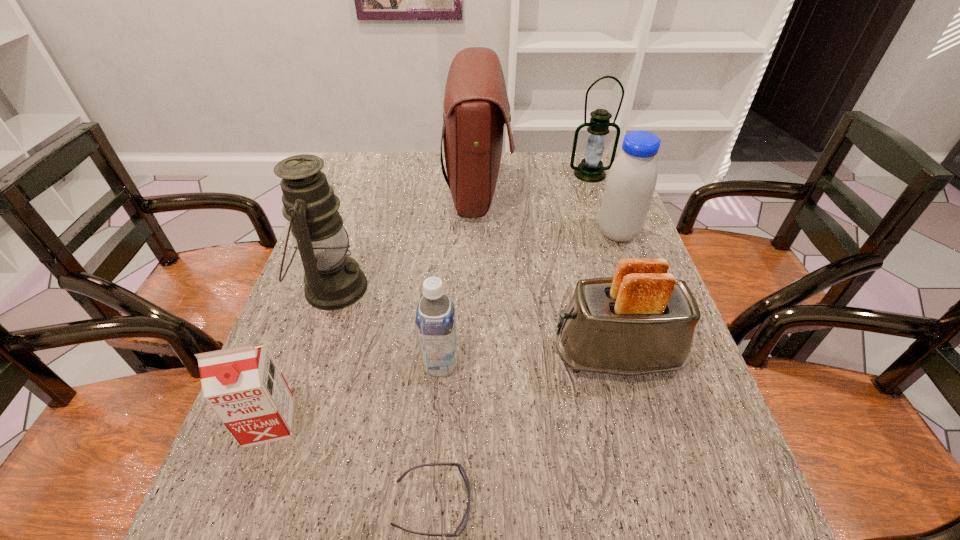
Find the location of a particular element. The height and width of the screenshot is (540, 960). satchel is located at coordinates (476, 106).

Where is `the fifth nearest object`? The image size is (960, 540). the fifth nearest object is located at coordinates (333, 280).

In order to click on lantern in this screenshot , I will do `click(591, 169)`.

Identify the location of the tallest soya milk. (631, 181).

The width and height of the screenshot is (960, 540). In order to click on the rightmost soya milk in this screenshot , I will do `click(631, 181)`.

This screenshot has width=960, height=540. In order to click on toaster in this screenshot , I will do `click(641, 321)`.

Where is `the second nearest soya milk`? the second nearest soya milk is located at coordinates (435, 318).

This screenshot has height=540, width=960. Identify the location of the nearest soya milk. (244, 386).

The image size is (960, 540). Identify the location of the leftmost soya milk. (244, 386).

Where is `free space located on the open flap of the satchel`? free space located on the open flap of the satchel is located at coordinates (538, 191).